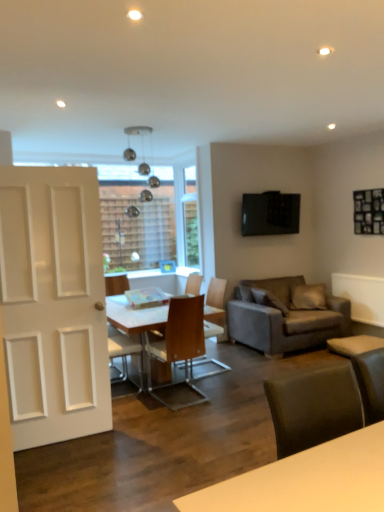
Where is `vacant area that lies to the right of white matte door at left`? vacant area that lies to the right of white matte door at left is located at coordinates (132, 439).